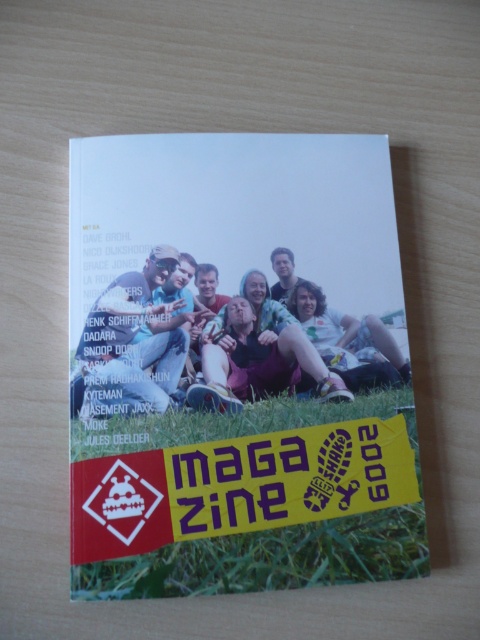
Is green grass at lower center to the left of light blue fabric at center from the viewer's perspective?

In fact, green grass at lower center is to the right of light blue fabric at center.

Measure the distance between green grass at lower center and camera.

They are 25.24 inches apart.

Which is behind, point (176, 477) or point (104, 353)?

The point (104, 353) is behind.

I want to click on green grass at lower center, so click(x=253, y=500).

Which is behind, point (156, 305) or point (352, 356)?

The point (352, 356) is behind.

Can you confirm if light blue fabric at center is positioned to the right of green fabric pants at center?

In fact, light blue fabric at center is to the left of green fabric pants at center.

Does point (119, 356) lie behind point (383, 365)?

That is False.

Image resolution: width=480 pixels, height=640 pixels. I want to click on light blue fabric at center, so click(135, 340).

Which is behind, point (180, 536) or point (290, 310)?

The point (290, 310) is more distant.

Between matte paper magazine at center and green fabric pants at center, which one has less height?

green fabric pants at center is shorter.

Is point (121, 502) in front of point (373, 332)?

Yes, it is in front of point (373, 332).

You are a GUI agent. You are given a task and a screenshot of the screen. Output one action in this format:
    pyautogui.click(x=<x>, y=<y>)
    Task: Click on the matte paper magazine at center
    The height and width of the screenshot is (640, 480).
    Given the screenshot: What is the action you would take?
    pyautogui.click(x=235, y=364)